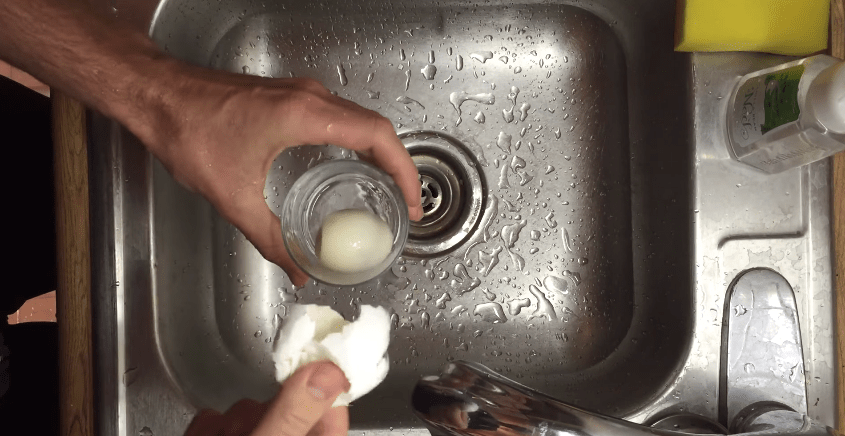
What are the coordinates of `clear glass container` in the screenshot? It's located at (336, 198).